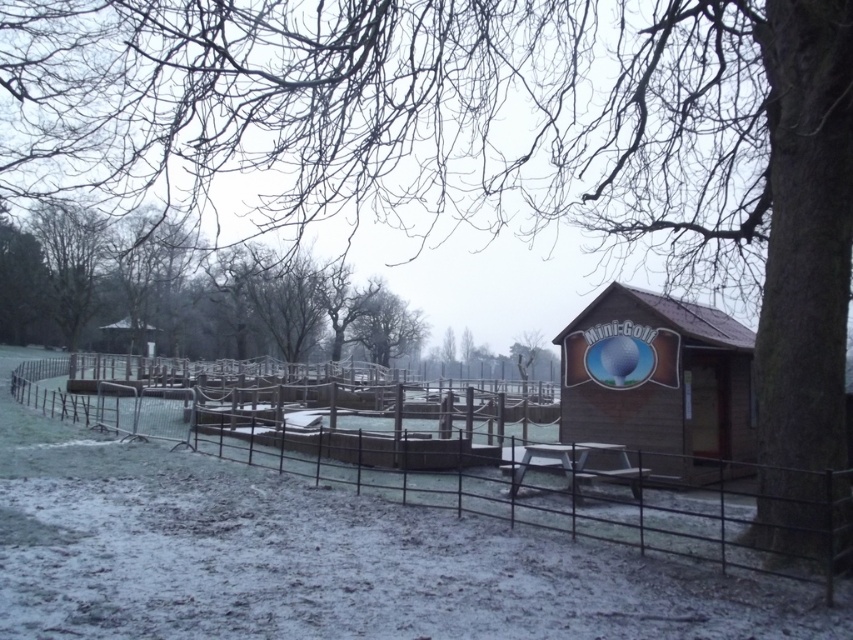
You are standing at the entrance of the mini golf course and want to reach the wooden hut at center. The bare wood fence at left is in your way. Can you walk around the fence to get to the hut?

The wooden hut at center is behind the bare wood fence at left, so you can walk around the fence to reach the wooden hut at center.

You are a snowplow operator needing to clear snow between the wooden fence at center and the wooden hut at center. The snowplow is 10 feet wide. Can you fit through the space between them?

The wooden fence at center and wooden hut at center are 9.97 feet apart from each other, so the snowplow cannot fit through the space between them since it is narrower than the plow.